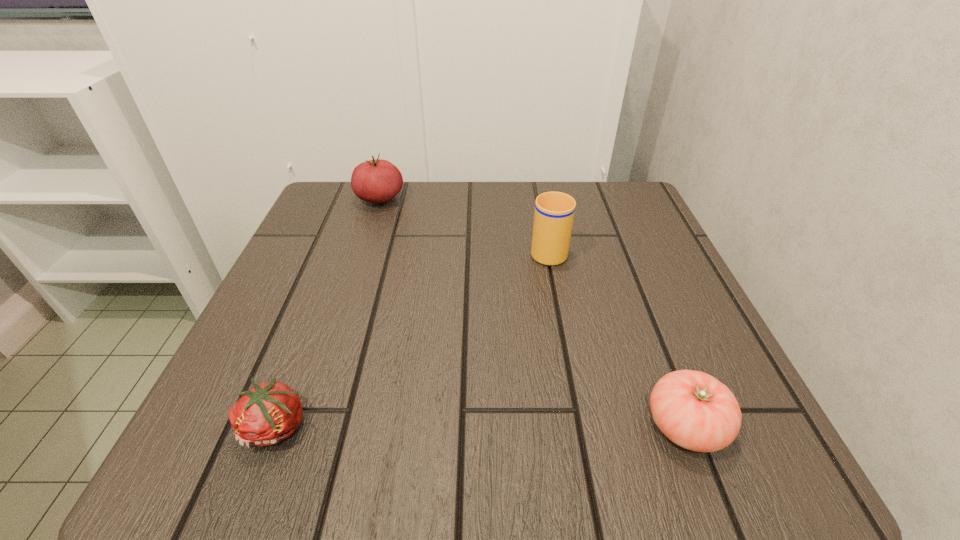
Where is `cup present at the far edge`? cup present at the far edge is located at coordinates (554, 212).

You are a GUI agent. You are given a task and a screenshot of the screen. Output one action in this format:
    pyautogui.click(x=<x>, y=<y>)
    Task: Click on the tomato positioned at the far edge
    The image size is (960, 540).
    Given the screenshot: What is the action you would take?
    pyautogui.click(x=376, y=181)

At what (x,y) coordinates should I click in order to perform the action: click on object that is at the right edge. Please return your answer as a coordinate pair (x, y). The height and width of the screenshot is (540, 960). Looking at the image, I should click on (693, 409).

The width and height of the screenshot is (960, 540). In order to click on object at the far left corner in this screenshot , I will do `click(376, 181)`.

Where is `object that is positioned at the near left corner`? object that is positioned at the near left corner is located at coordinates (268, 413).

The width and height of the screenshot is (960, 540). In order to click on object located in the near right corner section of the desktop in this screenshot , I will do `click(693, 409)`.

The height and width of the screenshot is (540, 960). Find the location of `free space at the far edge of the desktop`. free space at the far edge of the desktop is located at coordinates (408, 203).

Where is `vacant space at the near edge`? The height and width of the screenshot is (540, 960). vacant space at the near edge is located at coordinates (365, 460).

The image size is (960, 540). Find the location of `free space at the left edge`. free space at the left edge is located at coordinates coord(287,265).

What are the coordinates of `vacant area at the right edge of the desktop` in the screenshot? It's located at (624, 313).